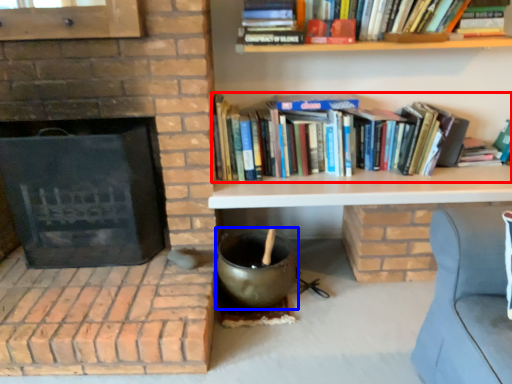
Question: Among these objects, which one is nearest to the camera, book (highlighted by a red box) or wok (highlighted by a blue box)?

Choices:
 (A) book
 (B) wok

Answer: (B)